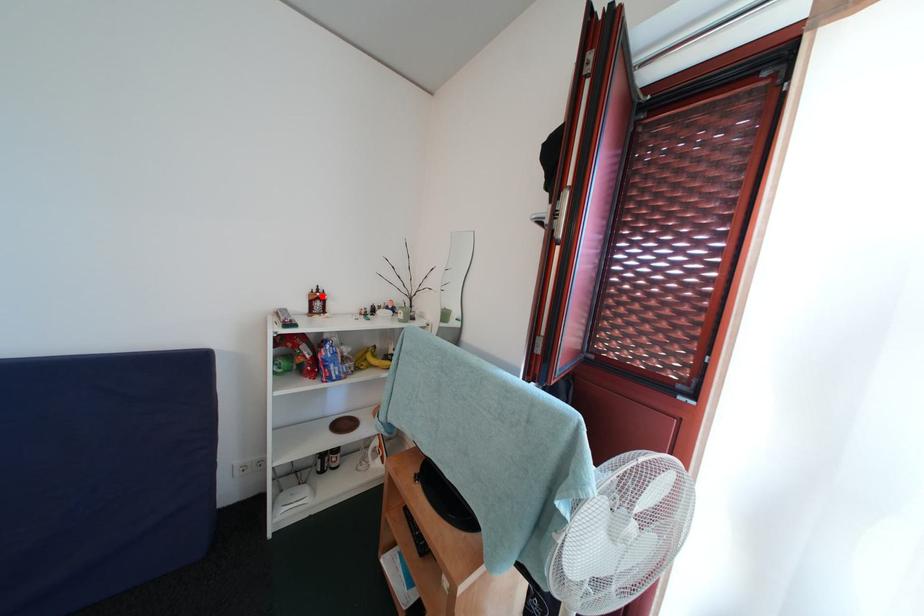
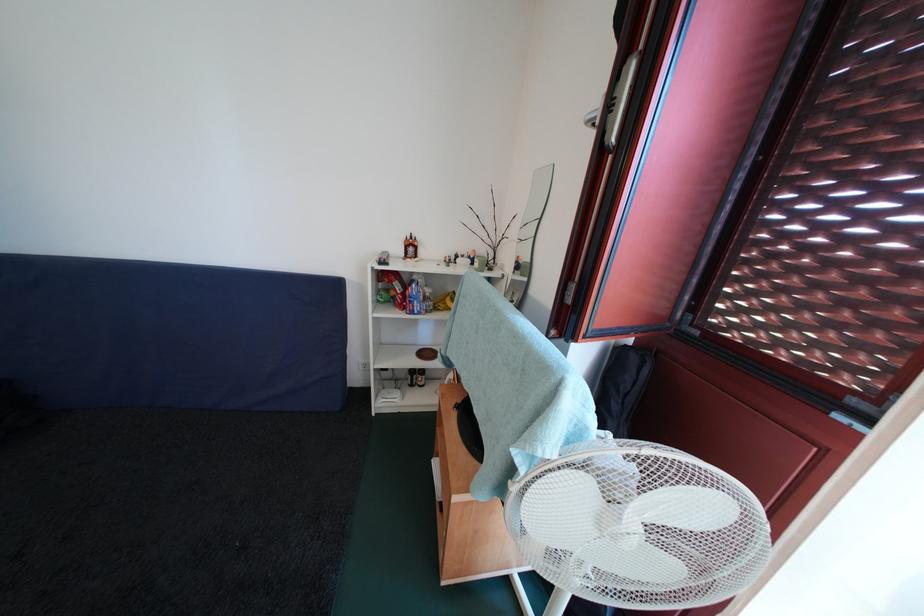
In the second image, find the point that corresponds to the highlighted location in the first image.

(416, 243)